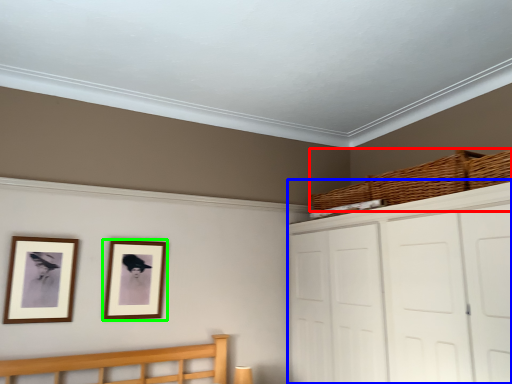
Question: Based on their relative distances, which object is farther from basket (highlighted by a red box)? Choose from dresser (highlighted by a blue box) and picture frame (highlighted by a green box).

Choices:
 (A) dresser
 (B) picture frame

Answer: (B)